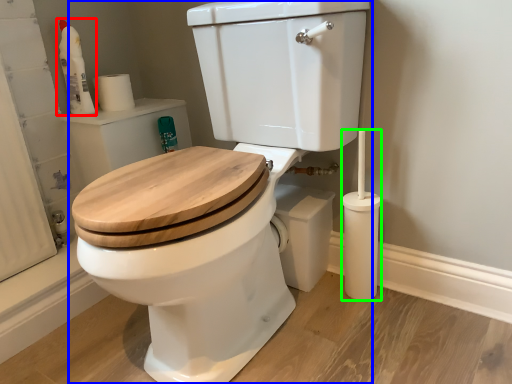
Question: Which is nearer to the cleaning product (highlighted by a red box)? toilet (highlighted by a blue box) or brush (highlighted by a green box).

Choices:
 (A) toilet
 (B) brush

Answer: (A)